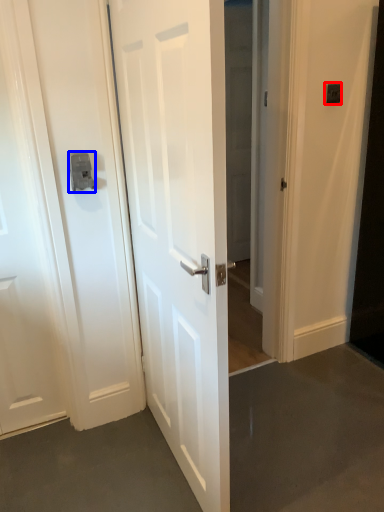
Question: Which object appears farthest to the camera in this image, light switch (highlighted by a red box) or latch (highlighted by a blue box)?

Choices:
 (A) light switch
 (B) latch

Answer: (A)